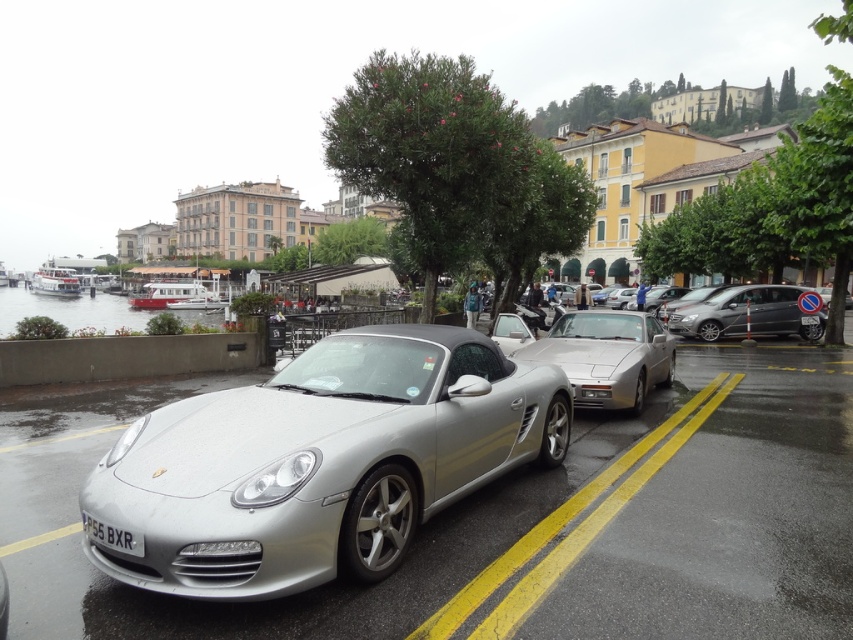
You are a photographer setting up a tripod to capture the silver metallic sports car at center and the black plastic license plate at lower center. Based on their positions, will the license plate be visible in the frame if you focus on the sports car?

The silver metallic sports car at center is above the black plastic license plate at lower center, so if you focus on the sports car, the license plate will still be visible in the frame as it is positioned below the car.

You are a photographer planning to take a photo of the silver metallic sports car at center and the metallic silver minivan at right. Since both vehicles are silver, you want to ensure the minivan is clearly visible in the photo. Based on their positions, can you confirm if the minivan will not be obscured by the sports car?

The silver metallic sports car at center is in front of the metallic silver minivan at right, so the minivan might be partially obscured by the sports car. Adjust your angle to ensure the minivan is fully visible.

You are standing at the point marked as point (511, 522) in the image. What object are you touching?

The point (511, 522) is on the silver metallic car at center, so you are touching the silver metallic car at center.